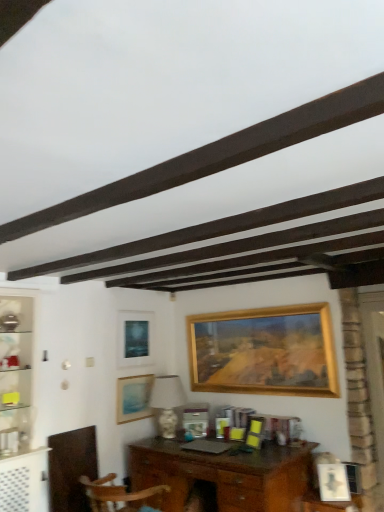
Question: Considering the relative sizes of matte black picture frame at center, the fifth picture frame from the right, and matte white picture frame at lower right, the 5th picture frame in the left-to-right sequence, in the image provided, is matte black picture frame at center, the fifth picture frame from the right, taller than matte white picture frame at lower right, the 5th picture frame in the left-to-right sequence,?

Choices:
 (A) yes
 (B) no

Answer: (A)

Question: Would you consider matte black picture frame at center, marked as the 1th picture frame in a left-to-right arrangement, to be distant from matte white picture frame at lower right, the first picture frame in the right-to-left sequence?

Choices:
 (A) no
 (B) yes

Answer: (B)

Question: Is matte black picture frame at center, the fifth picture frame from the right, smaller than matte white picture frame at lower right, the 5th picture frame in the left-to-right sequence?

Choices:
 (A) yes
 (B) no

Answer: (B)

Question: Is matte white picture frame at lower right, the first picture frame in the right-to-left sequence, at the back of matte black picture frame at center, marked as the 1th picture frame in a left-to-right arrangement?

Choices:
 (A) no
 (B) yes

Answer: (A)

Question: Is matte black picture frame at center, the fifth picture frame from the right, next to matte white picture frame at lower right, the 5th picture frame in the left-to-right sequence, and touching it?

Choices:
 (A) no
 (B) yes

Answer: (A)

Question: From a real-world perspective, is matte black picture frame at center, the fifth picture frame from the right, physically above matte white picture frame at lower right, the first picture frame in the right-to-left sequence?

Choices:
 (A) yes
 (B) no

Answer: (A)

Question: Is matte white picture frame at lower right, the 5th picture frame in the left-to-right sequence, at the back of wooden desk at center?

Choices:
 (A) yes
 (B) no

Answer: (B)

Question: Is wooden desk at center next to matte white picture frame at lower right, the first picture frame in the right-to-left sequence, and touching it?

Choices:
 (A) yes
 (B) no

Answer: (B)

Question: Is the position of wooden desk at center more distant than that of matte white picture frame at lower right, the first picture frame in the right-to-left sequence?

Choices:
 (A) no
 (B) yes

Answer: (A)

Question: Does wooden desk at center have a lesser height compared to matte white picture frame at lower right, the first picture frame in the right-to-left sequence?

Choices:
 (A) yes
 (B) no

Answer: (B)

Question: Is matte white picture frame at lower right, the 5th picture frame in the left-to-right sequence, completely or partially inside wooden desk at center?

Choices:
 (A) yes
 (B) no

Answer: (B)

Question: Can you confirm if wooden desk at center is smaller than matte white picture frame at lower right, the 5th picture frame in the left-to-right sequence?

Choices:
 (A) yes
 (B) no

Answer: (B)

Question: Does wooden desk at center have a greater height compared to wooden picture frame at center, placed as the 3th picture frame when sorted from right to left?

Choices:
 (A) no
 (B) yes

Answer: (B)